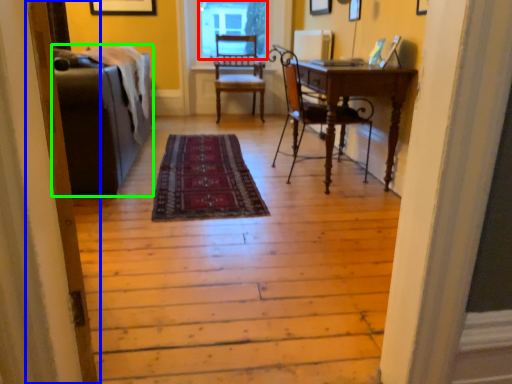
Question: Based on their relative distances, which object is farther from window screen (highlighted by a red box)? Choose from screen door (highlighted by a blue box) and couch (highlighted by a green box).

Choices:
 (A) screen door
 (B) couch

Answer: (A)